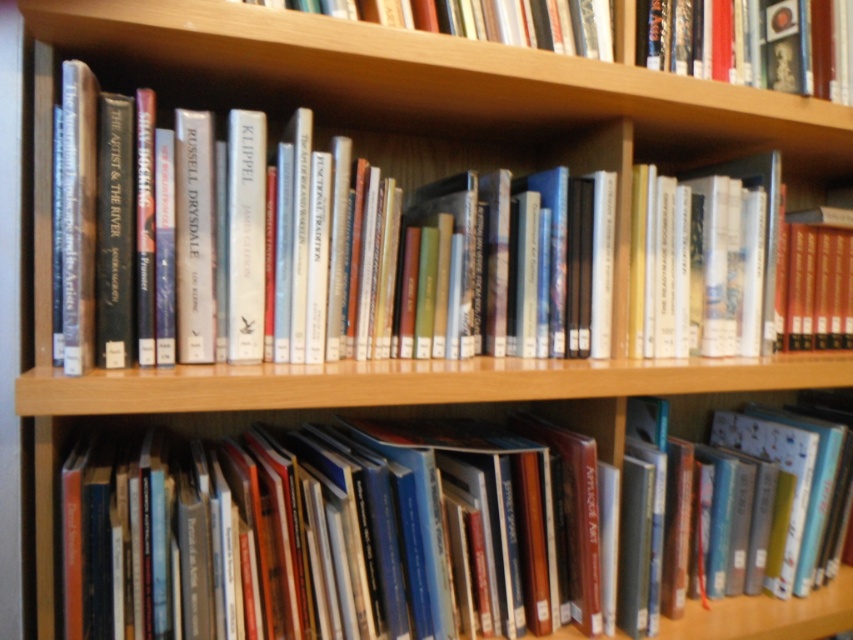
You are organizing books on a wooden bookshelf. You have a new book that needs to be placed to the right of the hardcover book at upper right. Where should you place it relative to the hardcover book at lower center?

The new book should be placed to the right of the hardcover book at upper right, which is to the left of the hardcover book at lower center. Therefore, the new book will be positioned to the left of the hardcover book at lower center.

You are trying to place a new book on the shelf. You have a new book that is 12 cm wide. The hardcover book at lower center and the hardcover books at center are already occupying space. Can you determine if there is enough space between them to fit your new book?

The hardcover book at lower center might be wider than hardcover books at center. If the hardcover book at lower center is indeed wider, there might not be enough space between them to fit a 12 cm wide book. You should measure the available space carefully before placing the new book.